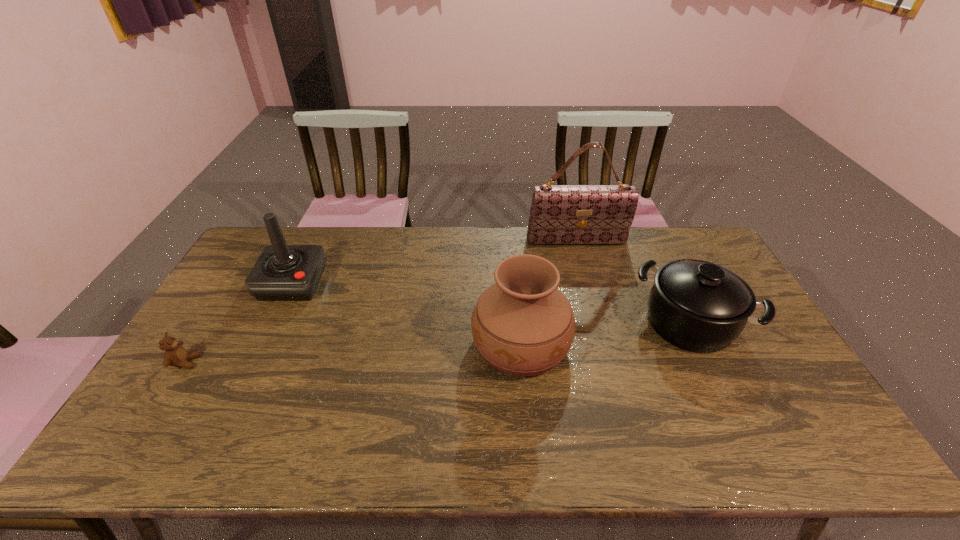
This screenshot has width=960, height=540. Find the location of `vacant space at the left edge`. vacant space at the left edge is located at coordinates (229, 340).

Identify the location of vacant space at the right edge of the desktop. This screenshot has height=540, width=960. (797, 377).

You are a GUI agent. You are given a task and a screenshot of the screen. Output one action in this format:
    pyautogui.click(x=<x>, y=<y>)
    Task: Click on the free space between the fourth tallest object and the handbag
    
    Given the screenshot: What is the action you would take?
    pyautogui.click(x=633, y=282)

This screenshot has width=960, height=540. In order to click on vacant region between the teddy bear and the joystick in this screenshot , I will do `click(239, 322)`.

Locate an element on the screen. free space between the joystick and the urn is located at coordinates (407, 313).

This screenshot has height=540, width=960. Identify the location of empty location between the joystick and the teddy bear. (239, 322).

Where is `free space between the shortest object and the urn`? The width and height of the screenshot is (960, 540). free space between the shortest object and the urn is located at coordinates (353, 353).

This screenshot has width=960, height=540. What are the coordinates of `vacant point located between the saucepan and the handbag` in the screenshot? It's located at (633, 282).

The width and height of the screenshot is (960, 540). I want to click on empty space between the shortest object and the fourth object from right to left, so click(x=239, y=322).

Find the location of a particular element. free space between the joystick and the teddy bear is located at coordinates (239, 322).